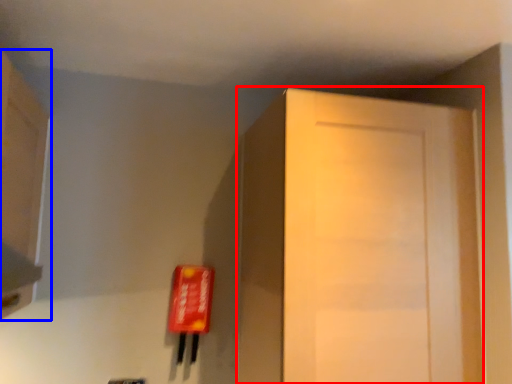
Question: Which object is further to the camera taking this photo, door (highlighted by a red box) or cabinetry (highlighted by a blue box)?

Choices:
 (A) door
 (B) cabinetry

Answer: (A)